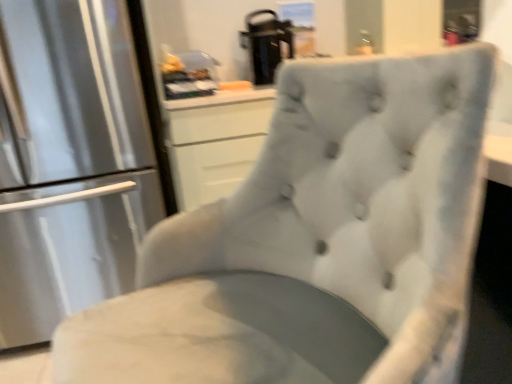
The image size is (512, 384). I want to click on satin silver refrigerator at left, so click(x=69, y=162).

Image resolution: width=512 pixels, height=384 pixels. What do you see at coordinates (69, 162) in the screenshot? I see `satin silver refrigerator at left` at bounding box center [69, 162].

Measure the distance between black plastic coffee maker at upper center and camera.

black plastic coffee maker at upper center and camera are 6.68 feet apart from each other.

Where is `black plastic coffee maker at upper center`? The image size is (512, 384). black plastic coffee maker at upper center is located at coordinates (266, 44).

Describe the element at coordinates (266, 44) in the screenshot. I see `black plastic coffee maker at upper center` at that location.

You are a GUI agent. You are given a task and a screenshot of the screen. Output one action in this format:
    pyautogui.click(x=<x>, y=<y>)
    Task: Click on the satin silver refrigerator at left
    This screenshot has width=512, height=384.
    Given the screenshot: What is the action you would take?
    pyautogui.click(x=69, y=162)

Between satin silver refrigerator at left and black plastic coffee maker at upper center, which one appears on the left side from the viewer's perspective?

satin silver refrigerator at left is more to the left.

Consider the image. In the image, is satin silver refrigerator at left positioned in front of or behind black plastic coffee maker at upper center?

satin silver refrigerator at left is positioned closer to the viewer than black plastic coffee maker at upper center.

Does point (126, 108) appear closer or farther from the camera than point (249, 18)?

Point (126, 108).

From the image's perspective, would you say satin silver refrigerator at left is shown under black plastic coffee maker at upper center?

Yes.

From a real-world perspective, is satin silver refrigerator at left located higher than black plastic coffee maker at upper center?

No, from a real-world perspective, satin silver refrigerator at left is not above black plastic coffee maker at upper center.

Which object is thinner, satin silver refrigerator at left or black plastic coffee maker at upper center?

black plastic coffee maker at upper center.

Considering the sizes of objects satin silver refrigerator at left and black plastic coffee maker at upper center in the image provided, who is taller, satin silver refrigerator at left or black plastic coffee maker at upper center?

With more height is satin silver refrigerator at left.

Who is smaller, satin silver refrigerator at left or black plastic coffee maker at upper center?

With smaller size is black plastic coffee maker at upper center.

Is satin silver refrigerator at left completely or partially outside of black plastic coffee maker at upper center?

Indeed, satin silver refrigerator at left is completely outside black plastic coffee maker at upper center.

Consider the image. Are satin silver refrigerator at left and black plastic coffee maker at upper center beside each other?

satin silver refrigerator at left is not next to black plastic coffee maker at upper center, and they're not touching.

Consider the image. Is satin silver refrigerator at left positioned with its back to black plastic coffee maker at upper center?

No, satin silver refrigerator at left's orientation is not away from black plastic coffee maker at upper center.

How different are the orientations of satin silver refrigerator at left and black plastic coffee maker at upper center in degrees?

1.54 degrees separate the facing orientations of satin silver refrigerator at left and black plastic coffee maker at upper center.

How distant is satin silver refrigerator at left from black plastic coffee maker at upper center?

The distance of satin silver refrigerator at left from black plastic coffee maker at upper center is 94.15 centimeters.

You are a GUI agent. You are given a task and a screenshot of the screen. Output one action in this format:
    pyautogui.click(x=<x>, y=<y>)
    Task: Click on the appliance on the right of the satin silver refrigerator at left
    
    Given the screenshot: What is the action you would take?
    pyautogui.click(x=266, y=44)

Between black plastic coffee maker at upper center and satin silver refrigerator at left, which one appears on the right side from the viewer's perspective?

From the viewer's perspective, black plastic coffee maker at upper center appears more on the right side.

Which is behind, black plastic coffee maker at upper center or satin silver refrigerator at left?

black plastic coffee maker at upper center is further from the camera.

Does point (269, 43) come farther from viewer compared to point (32, 182)?

Yes, it is behind point (32, 182).

From the image's perspective, relative to satin silver refrigerator at left, is black plastic coffee maker at upper center above or below?

From the image's perspective, black plastic coffee maker at upper center appears above satin silver refrigerator at left.

From a real-world perspective, is black plastic coffee maker at upper center positioned above or below satin silver refrigerator at left?

black plastic coffee maker at upper center is situated higher than satin silver refrigerator at left in the real world.

Between black plastic coffee maker at upper center and satin silver refrigerator at left, which one has smaller width?

black plastic coffee maker at upper center is thinner.

Who is taller, black plastic coffee maker at upper center or satin silver refrigerator at left?

satin silver refrigerator at left.

In terms of size, does black plastic coffee maker at upper center appear bigger or smaller than satin silver refrigerator at left?

Answer: In the image, black plastic coffee maker at upper center appears to be smaller than satin silver refrigerator at left.

Would you say black plastic coffee maker at upper center is inside or outside satin silver refrigerator at left?

black plastic coffee maker at upper center is spatially situated outside satin silver refrigerator at left.

In the scene shown: Is black plastic coffee maker at upper center not near satin silver refrigerator at left?

Actually, black plastic coffee maker at upper center and satin silver refrigerator at left are a little close together.

Is black plastic coffee maker at upper center turned away from satin silver refrigerator at left?

No.

The height and width of the screenshot is (384, 512). In order to click on refrigerator that appears in front of the black plastic coffee maker at upper center in this screenshot , I will do `click(69, 162)`.

Where is `refrigerator below the black plastic coffee maker at upper center (from the image's perspective)`? refrigerator below the black plastic coffee maker at upper center (from the image's perspective) is located at coordinates (69, 162).

The height and width of the screenshot is (384, 512). Find the location of `refrigerator on the left of black plastic coffee maker at upper center`. refrigerator on the left of black plastic coffee maker at upper center is located at coordinates (69, 162).